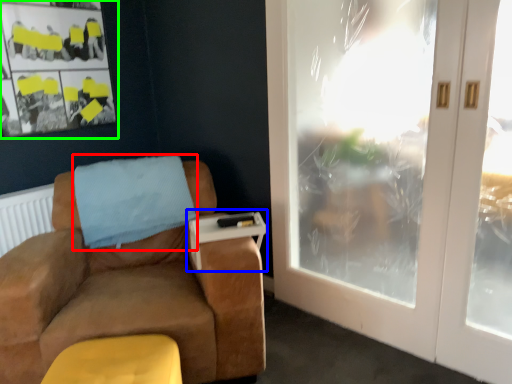
Question: Estimate the real-world distances between objects in this image. Which object is closer to blanket (highlighted by a red box), table (highlighted by a blue box) or bulletin board (highlighted by a green box)?

Choices:
 (A) table
 (B) bulletin board

Answer: (A)